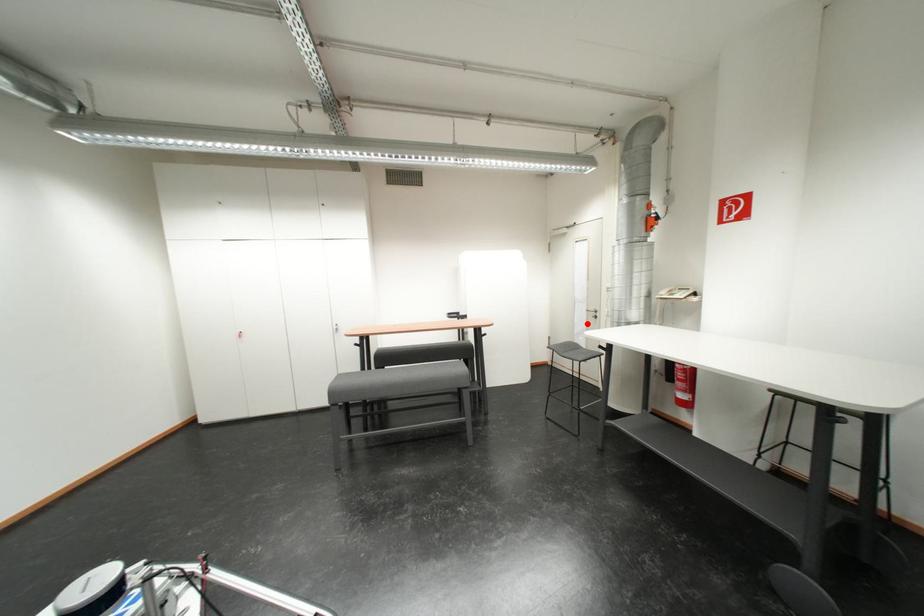
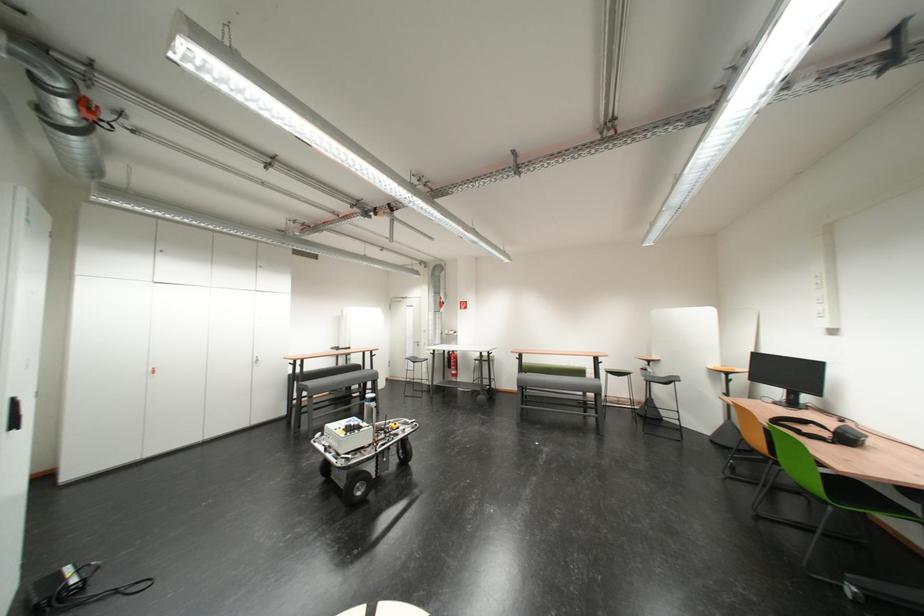
The point at the highlighted location is marked in the first image. Where is the corresponding point in the second image?

(419, 351)